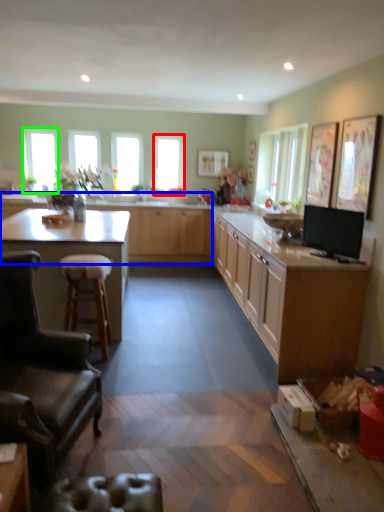
Question: Which is nearer to the window (highlighted by a red box)? cabinetry (highlighted by a blue box) or window (highlighted by a green box).

Choices:
 (A) cabinetry
 (B) window

Answer: (A)